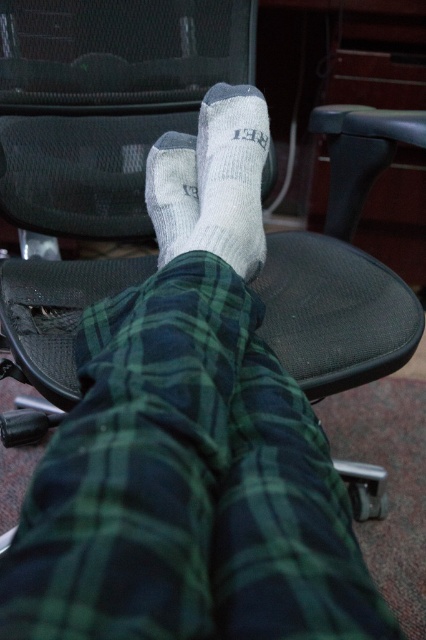
Is green plaid pants at center above gray/textured sock at center?

No, green plaid pants at center is not above gray/textured sock at center.

Is green plaid pants at center below gray/textured sock at center?

Indeed, green plaid pants at center is positioned under gray/textured sock at center.

What are the coordinates of `green plaid pants at center` in the screenshot? It's located at pos(187,484).

The height and width of the screenshot is (640, 426). In order to click on green plaid pants at center in this screenshot , I will do (x=187, y=484).

Which is in front, point (219, 380) or point (180, 161)?

Point (219, 380) is in front.

Locate an element on the screen. The image size is (426, 640). green plaid pants at center is located at coordinates (187, 484).

Locate an element on the screen. The width and height of the screenshot is (426, 640). green plaid pants at center is located at coordinates (187, 484).

Where is `green plaid pants at center`? The image size is (426, 640). green plaid pants at center is located at coordinates (187, 484).

Is gray/textured sock at center shorter than gray/textured socks at center?

No, gray/textured sock at center is not shorter than gray/textured socks at center.

Who is positioned more to the left, gray/textured sock at center or gray/textured socks at center?

gray/textured socks at center

Is point (258, 93) less distant than point (184, 202)?

No, it is not.

This screenshot has height=640, width=426. What are the coordinates of `gray/textured sock at center` in the screenshot? It's located at (230, 177).